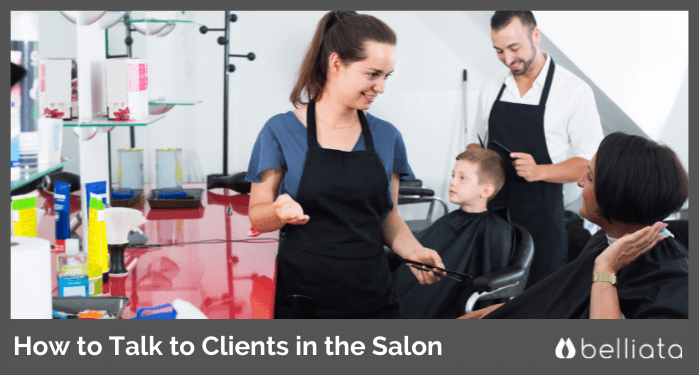
Locate an element on the screen. Image resolution: width=699 pixels, height=375 pixels. wall is located at coordinates (410, 111), (623, 39), (192, 58).